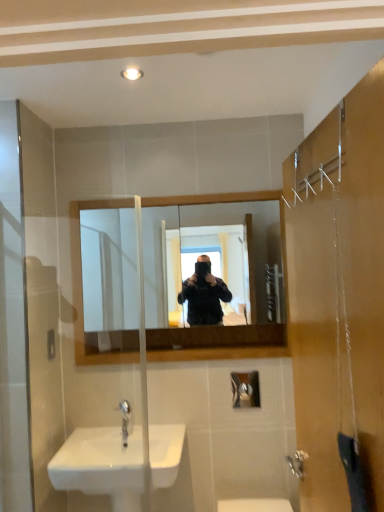
Question: Can you confirm if white glossy light fixture at upper center is bigger than white glossy sink at lower left?

Choices:
 (A) yes
 (B) no

Answer: (B)

Question: From a real-world perspective, is white glossy light fixture at upper center on top of white glossy sink at lower left?

Choices:
 (A) yes
 (B) no

Answer: (A)

Question: Is white glossy light fixture at upper center facing away from white glossy sink at lower left?

Choices:
 (A) no
 (B) yes

Answer: (A)

Question: Is white glossy light fixture at upper center to the right of white glossy sink at lower left from the viewer's perspective?

Choices:
 (A) no
 (B) yes

Answer: (B)

Question: From a real-world perspective, is white glossy light fixture at upper center below white glossy sink at lower left?

Choices:
 (A) yes
 (B) no

Answer: (B)

Question: Considering the relative sizes of white glossy light fixture at upper center and white glossy sink at lower left in the image provided, is white glossy light fixture at upper center thinner than white glossy sink at lower left?

Choices:
 (A) no
 (B) yes

Answer: (B)

Question: Can we say silver metallic faucet at lower center lies outside wooden frame mirror at center?

Choices:
 (A) yes
 (B) no

Answer: (A)

Question: Can you confirm if silver metallic faucet at lower center is positioned to the left of wooden frame mirror at center?

Choices:
 (A) yes
 (B) no

Answer: (A)

Question: From a real-world perspective, does silver metallic faucet at lower center stand above wooden frame mirror at center?

Choices:
 (A) yes
 (B) no

Answer: (B)

Question: Does silver metallic faucet at lower center come in front of wooden frame mirror at center?

Choices:
 (A) yes
 (B) no

Answer: (A)

Question: Considering the relative sizes of silver metallic faucet at lower center and wooden frame mirror at center in the image provided, is silver metallic faucet at lower center taller than wooden frame mirror at center?

Choices:
 (A) yes
 (B) no

Answer: (B)

Question: Considering the relative sizes of silver metallic faucet at lower center and wooden frame mirror at center in the image provided, is silver metallic faucet at lower center thinner than wooden frame mirror at center?

Choices:
 (A) no
 (B) yes

Answer: (A)

Question: Is white glossy light fixture at upper center looking in the opposite direction of silver metallic faucet at lower center?

Choices:
 (A) yes
 (B) no

Answer: (B)